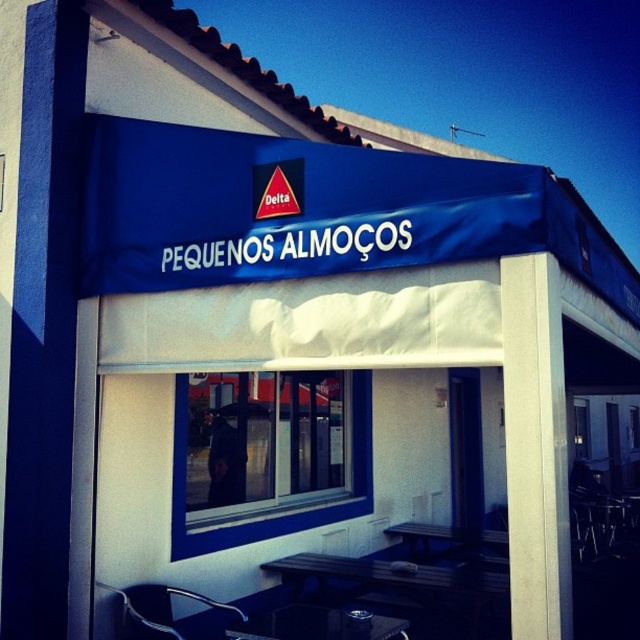
Question: Can you confirm if white smooth pillar at center is positioned to the right of metallic silver table at lower center?

Choices:
 (A) no
 (B) yes

Answer: (B)

Question: Estimate the real-world distances between objects in this image. Which object is farther from the white smooth pillar at center?

Choices:
 (A) metallic silver table at lower center
 (B) black wood table at lower center

Answer: (B)

Question: Which object is closer to the camera taking this photo?

Choices:
 (A) metallic silver table at lower center
 (B) black wood table at lower center

Answer: (A)

Question: Can you confirm if white smooth pillar at center is positioned to the right of black wood table at lower center?

Choices:
 (A) yes
 (B) no

Answer: (A)

Question: Which of the following is the closest to the observer?

Choices:
 (A) (296, 604)
 (B) (518, 312)

Answer: (B)

Question: Is white smooth pillar at center above metallic silver table at lower center?

Choices:
 (A) yes
 (B) no

Answer: (A)